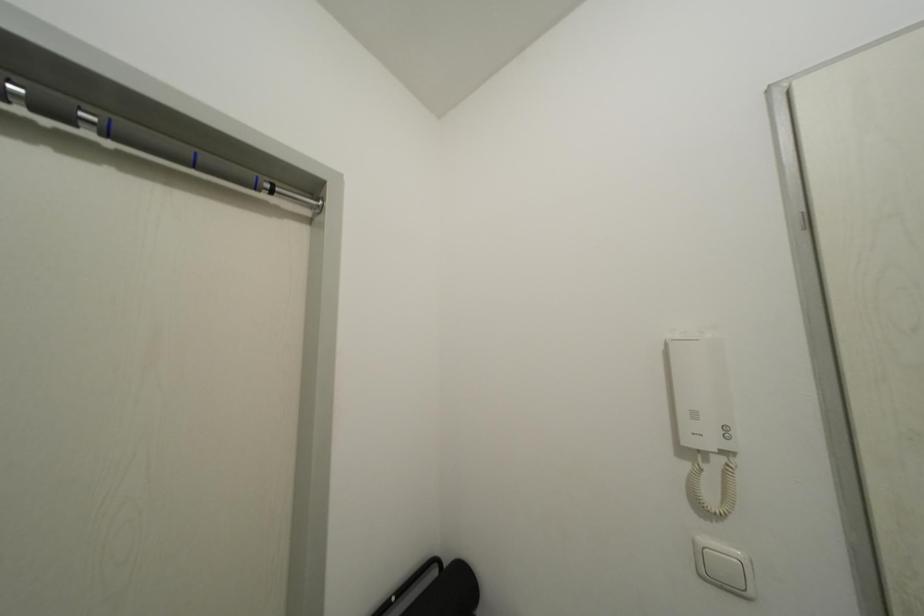
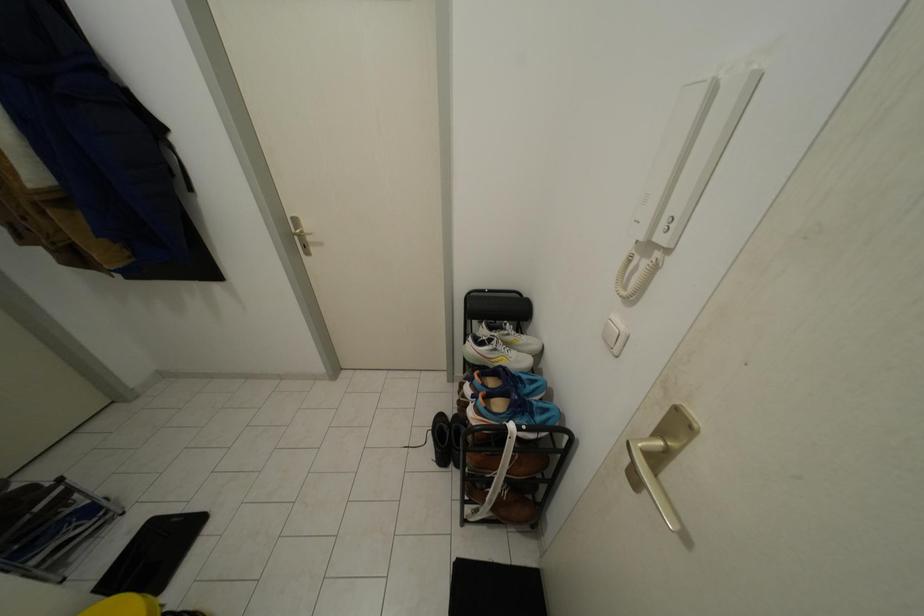
The images are taken continuously from a first-person perspective. In which direction is your viewpoint rotating?

The camera's rotation is toward left-down.